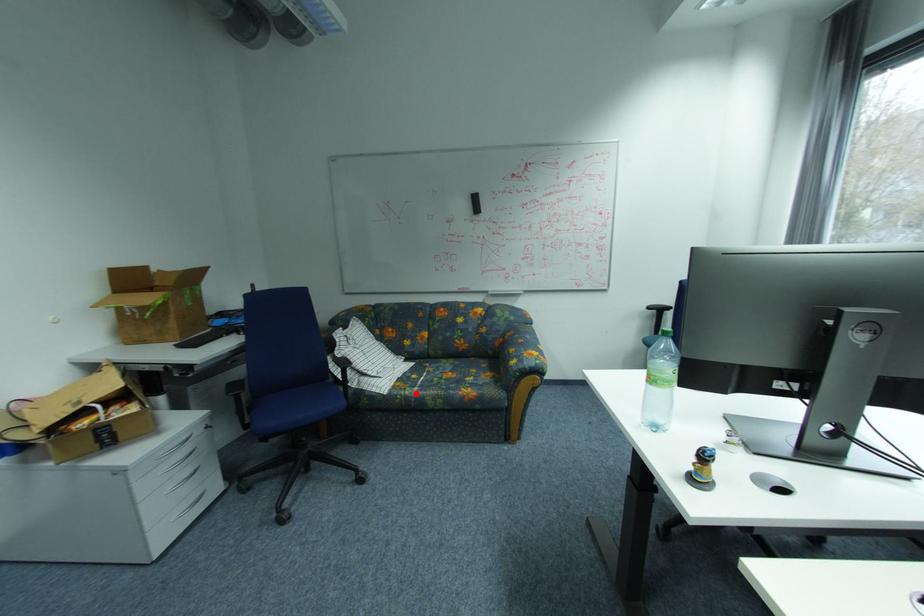
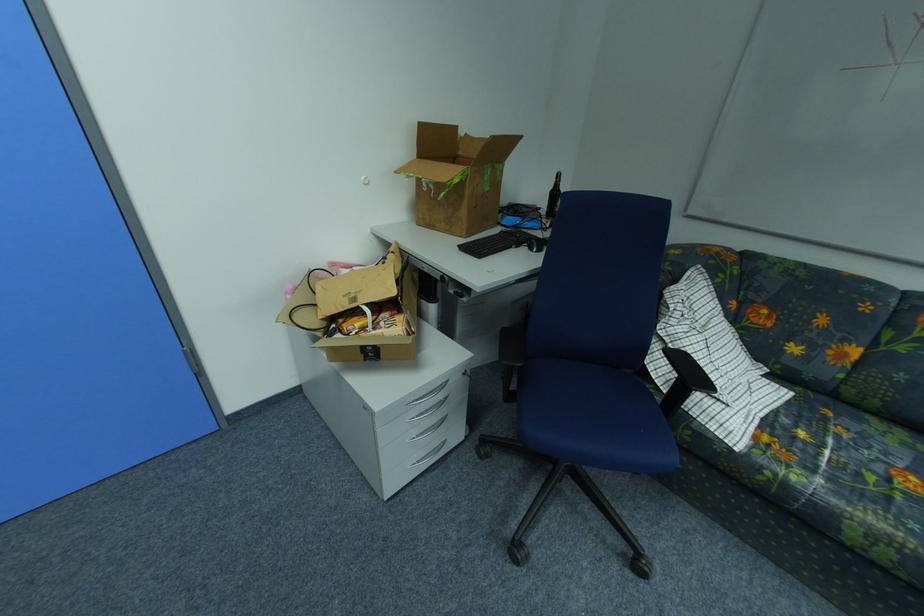
Locate, in the second image, the point that corresponds to the highlighted location in the first image.

(804, 479)